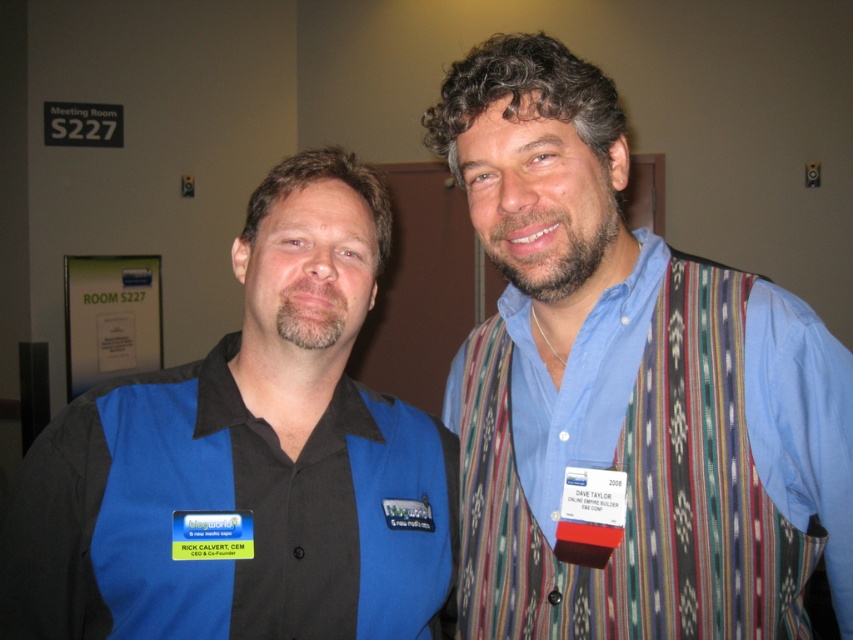
Question: Does blue striped vest at center have a larger size compared to black matte shirt at center?

Choices:
 (A) no
 (B) yes

Answer: (B)

Question: Which point is closer to the camera taking this photo?

Choices:
 (A) (108, 445)
 (B) (508, 145)

Answer: (B)

Question: Does blue striped vest at center have a smaller size compared to black matte shirt at center?

Choices:
 (A) no
 (B) yes

Answer: (A)

Question: Is blue striped vest at center positioned before black matte shirt at center?

Choices:
 (A) yes
 (B) no

Answer: (A)

Question: Which point appears closest to the camera in this image?

Choices:
 (A) (323, 179)
 (B) (502, 493)

Answer: (B)